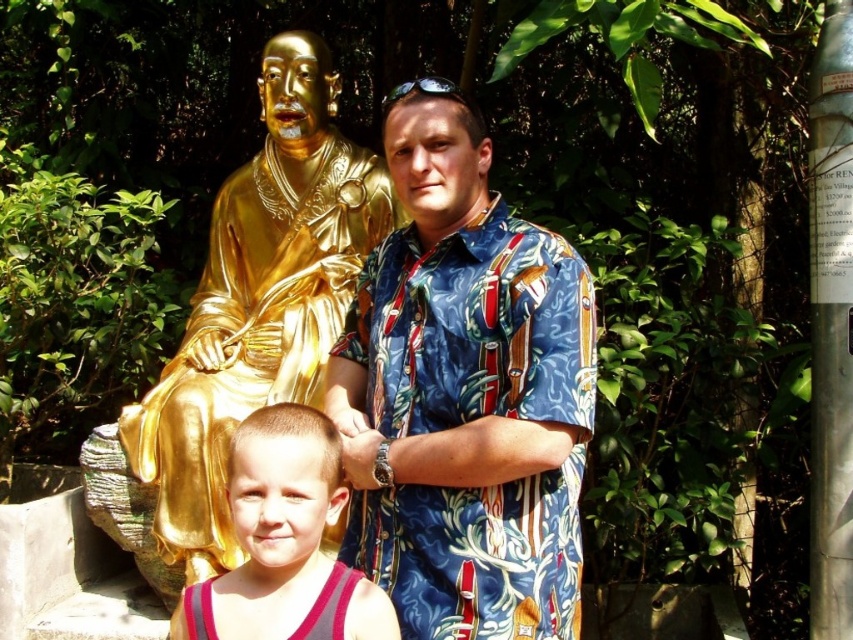
You are standing at the point labeled as point (x=234, y=340) in the image. You want to take a photo of the golden statue in the background. Is there anyone blocking your view of the statue?

The point labeled (x=234, y=340) is 6.22 meters away from the viewer. Since the statue is in the background and the individuals are positioned in front of it, there might be people blocking the view depending on their exact positions. However, the description does not provide specific details about the spatial relationship between the point and the people, so it cannot be definitively determined.

You are a photographer taking a picture of the blue printed shirt at center and the gold shiny statue at upper left. Which object is positioned more to the right side of the image?

The blue printed shirt at center is positioned more to the right of the gold shiny statue at upper left, so it is more to the right side of the image.

You are a photographer standing at the camera position. You want to take a photo of the gold shiny statue at upper left. The statue is 5.70 meters away from you. Your camera has a zoom lens that can focus on objects between 2 meters and 5 meters away. Will the statue be in focus in your photo?

The gold shiny statue at upper left is 5.70 meters away from the camera. Since the camera can focus on objects up to 5 meters away, the statue is beyond the maximum focusing distance of 5 meters. Therefore, the statue will not be in focus in the photo.